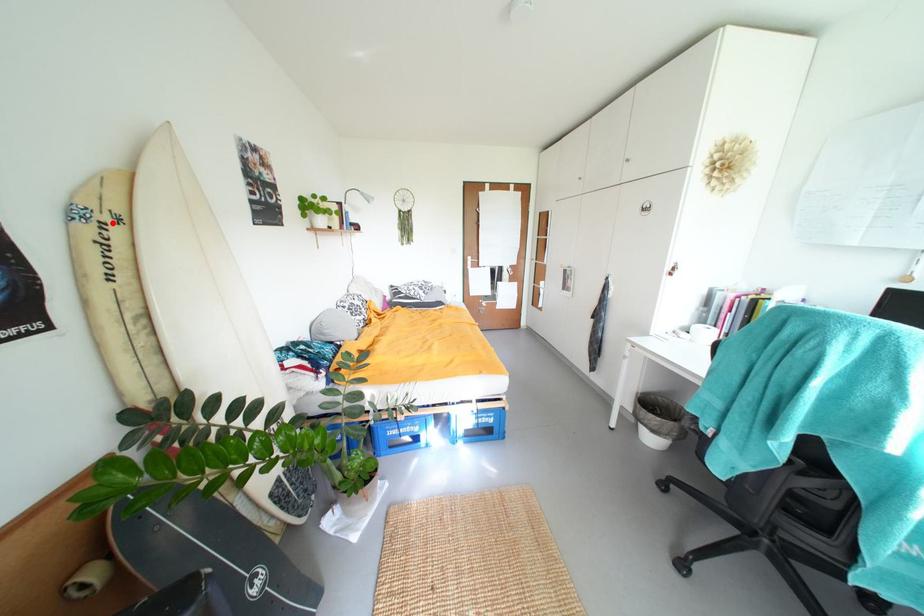
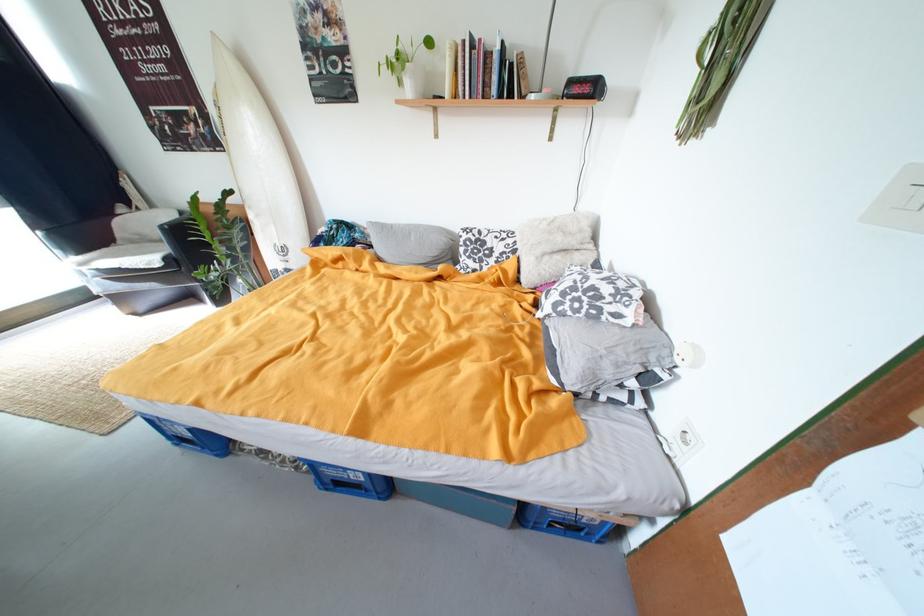
Locate, in the second image, the point that corresponds to the highlighted location in the first image.

(225, 108)